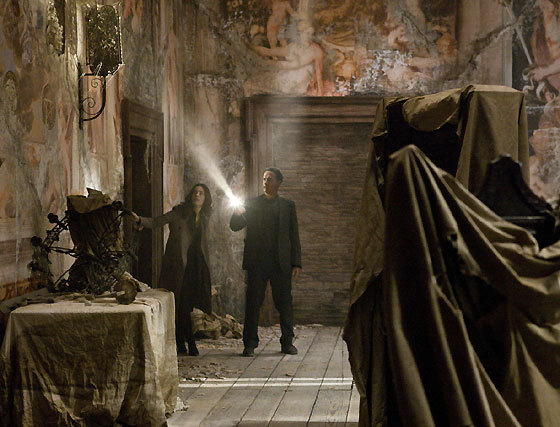
Where is `classical art mural`? classical art mural is located at coordinates (297, 32), (538, 69), (28, 77).